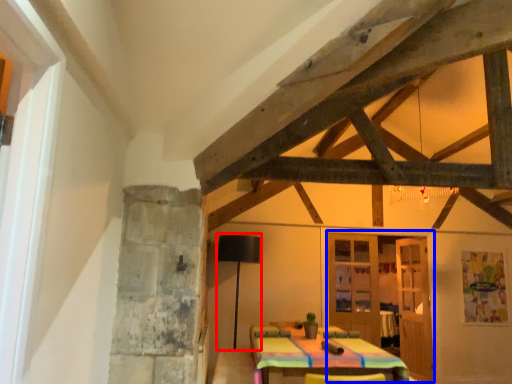
Question: Among these objects, which one is nearest to the camera, lamp (highlighted by a red box) or door (highlighted by a blue box)?

Choices:
 (A) lamp
 (B) door

Answer: (A)